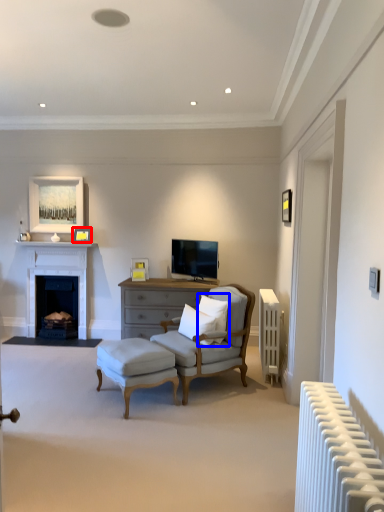
Question: Among these objects, which one is nearest to the camera, picture frame (highlighted by a red box) or pillow (highlighted by a blue box)?

Choices:
 (A) picture frame
 (B) pillow

Answer: (B)